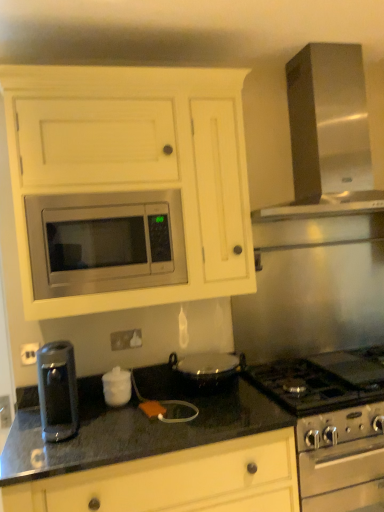
Question: Is satin silver stove at lower right, the second appliance when ordered from left to right, to the left of stainless steel microwave at center from the viewer's perspective?

Choices:
 (A) yes
 (B) no

Answer: (B)

Question: Is stainless steel microwave at center at the back of satin silver stove at lower right, which is the first appliance in bottom-to-top order?

Choices:
 (A) yes
 (B) no

Answer: (B)

Question: Does satin silver stove at lower right, the 1th appliance viewed from the right, have a lesser height compared to stainless steel microwave at center?

Choices:
 (A) yes
 (B) no

Answer: (B)

Question: Is satin silver stove at lower right, which is the first appliance in bottom-to-top order, placed right next to stainless steel microwave at center?

Choices:
 (A) no
 (B) yes

Answer: (A)

Question: Is the depth of satin silver stove at lower right, the 1th appliance viewed from the right, greater than that of stainless steel microwave at center?

Choices:
 (A) no
 (B) yes

Answer: (B)

Question: Considering their positions, is white glossy sugar bowl at center, which is the 2th appliance from right to left, located in front of or behind satin silver stove at lower right, the 1th appliance viewed from the right?

Choices:
 (A) behind
 (B) front

Answer: (A)

Question: Considering the positions of white glossy sugar bowl at center, acting as the first appliance starting from the top, and satin silver stove at lower right, the second appliance when ordered from left to right, in the image, is white glossy sugar bowl at center, acting as the first appliance starting from the top, bigger or smaller than satin silver stove at lower right, the second appliance when ordered from left to right,?

Choices:
 (A) small
 (B) big

Answer: (A)

Question: From the image's perspective, relative to satin silver stove at lower right, the second appliance from the top, is white glossy sugar bowl at center, which is the 2th appliance from right to left, above or below?

Choices:
 (A) below
 (B) above

Answer: (B)

Question: Is point (127, 397) closer or farther from the camera than point (311, 356)?

Choices:
 (A) farther
 (B) closer

Answer: (B)

Question: Is matte white cabinet at upper center wider or thinner than black granite countertop at lower center?

Choices:
 (A) thin
 (B) wide

Answer: (A)

Question: Considering the positions of point (87, 154) and point (92, 384), is point (87, 154) closer or farther from the camera than point (92, 384)?

Choices:
 (A) farther
 (B) closer

Answer: (B)

Question: In terms of height, does matte white cabinet at upper center look taller or shorter compared to black granite countertop at lower center?

Choices:
 (A) tall
 (B) short

Answer: (A)

Question: Visually, is matte white cabinet at upper center positioned to the left or to the right of black granite countertop at lower center?

Choices:
 (A) right
 (B) left

Answer: (B)

Question: From a real-world perspective, is stainless steel microwave at center physically located above or below black granite countertop at lower center?

Choices:
 (A) below
 (B) above

Answer: (B)

Question: In terms of height, does stainless steel microwave at center look taller or shorter compared to black granite countertop at lower center?

Choices:
 (A) tall
 (B) short

Answer: (B)